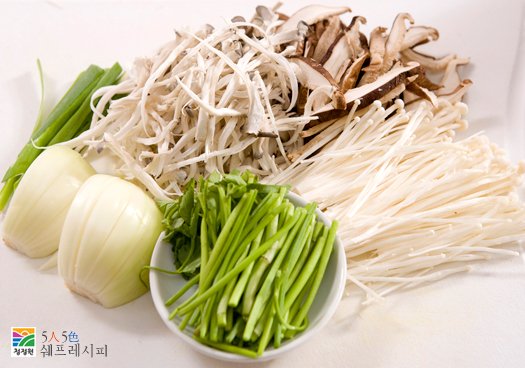
Find the location of a particular element. The image size is (525, 368). table is located at coordinates (425, 345).